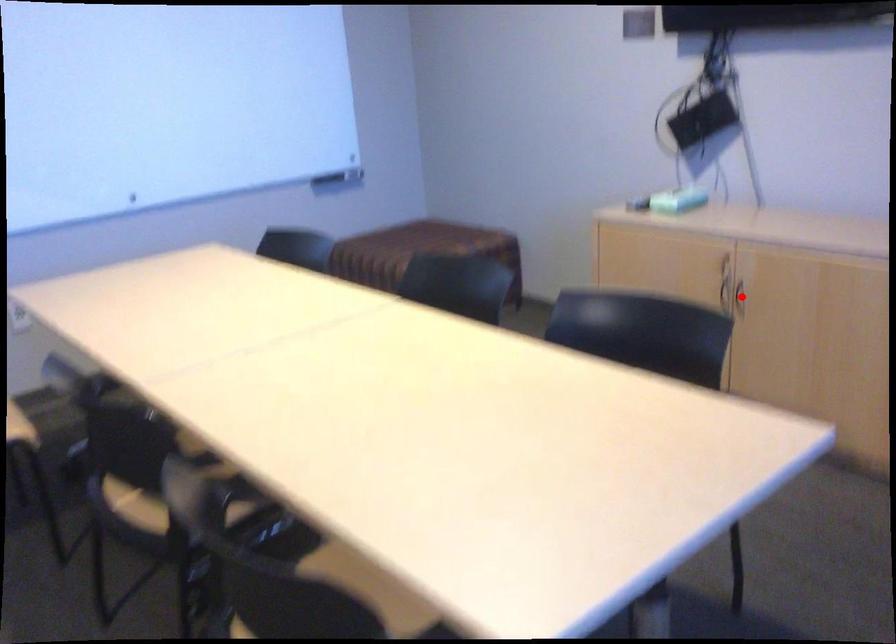
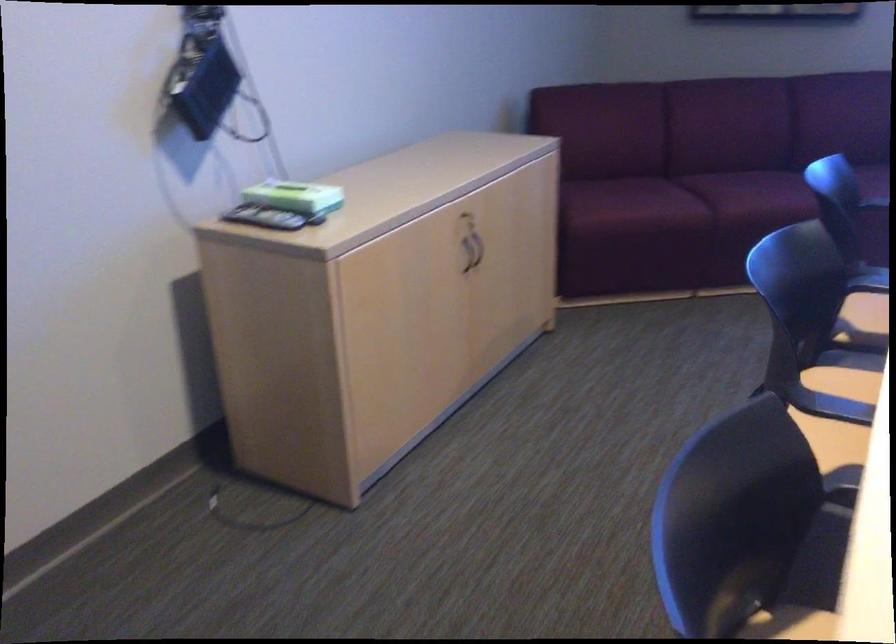
In the second image, find the point that corresponds to the highlighted location in the first image.

(464, 259)